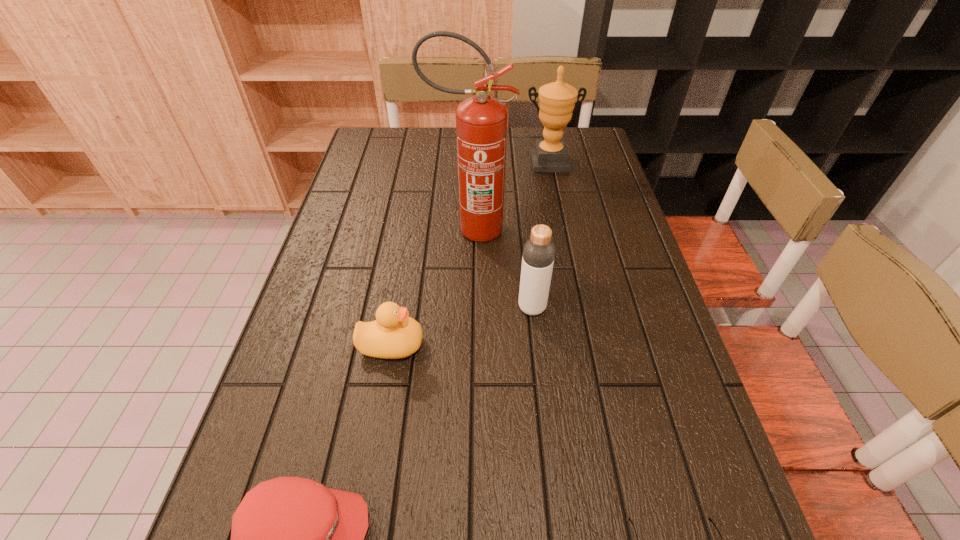
This screenshot has height=540, width=960. In order to click on vacant space at the far right corner in this screenshot , I will do `click(565, 141)`.

Find the location of a particular element. This screenshot has width=960, height=540. vacant area between the duck and the farthest object is located at coordinates (469, 253).

Find the location of a particular element. This screenshot has width=960, height=540. free space between the second farthest object and the fifth shortest object is located at coordinates (510, 196).

You are a GUI agent. You are given a task and a screenshot of the screen. Output one action in this format:
    pyautogui.click(x=<x>, y=<y>)
    Task: Click on the vacant point located between the duck and the third tallest object
    This screenshot has width=960, height=540.
    Given the screenshot: What is the action you would take?
    pyautogui.click(x=462, y=326)

Locate an element on the screen. vacant space that's between the fourth nearest object and the second farthest object is located at coordinates (501, 268).

Identify the location of free spot between the bottle and the tallest object. The height and width of the screenshot is (540, 960). (501, 268).

Select which object appears as the fifth closest to the bottle. Please provide its 2D coordinates. Your answer should be formatted as a tuple, i.e. [(x, y)], where the tuple contains the x and y coordinates of a point satisfying the conditions above.

[(557, 100)]

In order to click on object that stands as the fifth closest to the shortest object in this screenshot , I will do `click(557, 100)`.

Find the location of a particular element. The height and width of the screenshot is (540, 960). free spot that satisfies the following two spatial constraints: 1. at the front of the second tallest object with handles; 2. on the face of the duck is located at coordinates (586, 345).

Locate an element on the screen. The height and width of the screenshot is (540, 960). vacant space that satisfies the following two spatial constraints: 1. at the front of the farthest object with handles; 2. on the face of the fourth farthest object is located at coordinates (586, 345).